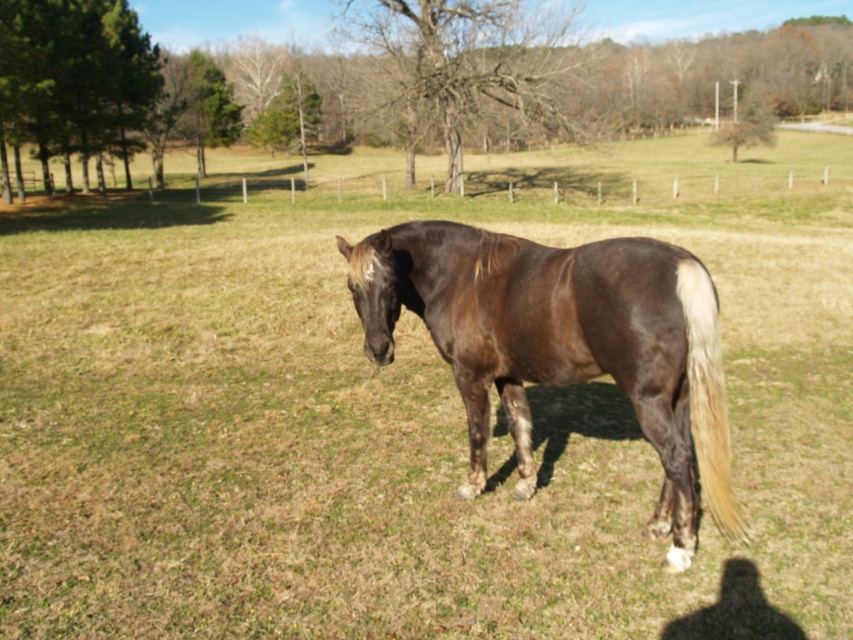
Is brown glossy horse at center below white silky tail at right?

No, brown glossy horse at center is not below white silky tail at right.

Does brown glossy horse at center have a smaller size compared to white silky tail at right?

No, brown glossy horse at center is not smaller than white silky tail at right.

Describe the element at coordinates (564, 344) in the screenshot. I see `brown glossy horse at center` at that location.

Identify the location of brown glossy horse at center. (564, 344).